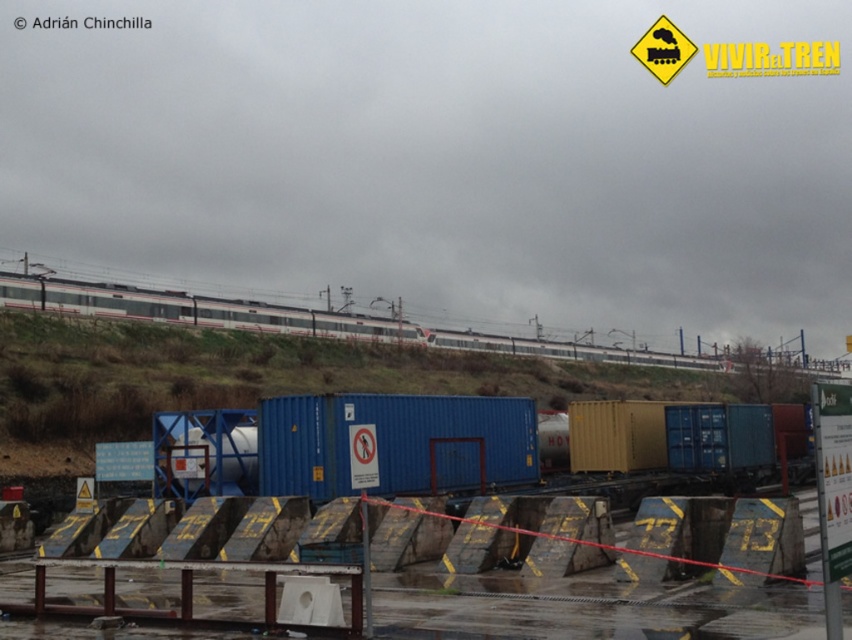
You are a delivery truck driver who needs to park your vehicle at the industrial site. The parking area is designated at point coordinates of 0.7, 0.46. Is the blue metallic shipping container at center blocking your parking spot?

The blue metallic shipping container at center is located at point coordinates of [394,444], which is very close to the parking spot at [390,448]. The slight difference in coordinates might mean it is not directly blocking, but the container could still be in close proximity, potentially obstructing access. Further on site assessment is needed to confirm.

You are a delivery driver arriving at the construction site. You need to park your truck near the blue metallic shipping container at center without blocking the white glossy train at upper center. Can you fit your truck between them if the truck is 10 meters long?

The blue metallic shipping container at center is smaller than the white glossy train at upper center. However, the exact distance between them isn t specified in the provided information. Without knowing the spatial relationship or the available space between the two objects, it s impossible to determine if the truck can fit. Please check the layout or consult site plans for accurate measurements.

You are a delivery driver who needs to park your truck near the blue metallic shipping container at center and the white glossy train at upper center. According to the site layout, which object should you park closer to if you want to be as close as possible to both?

The blue metallic shipping container at center is positioned on the left side of white glossy train at upper center, so parking closer to the blue metallic shipping container at center would place you nearer to both objects since it is adjacent to the train.